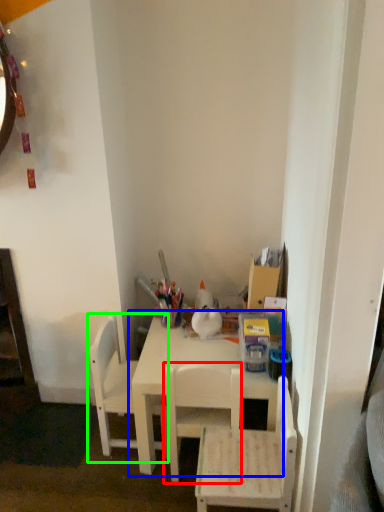
Question: Based on their relative distances, which object is farther from chair (highlighted by a red box)? Choose from table (highlighted by a blue box) and chair (highlighted by a green box).

Choices:
 (A) table
 (B) chair

Answer: (B)